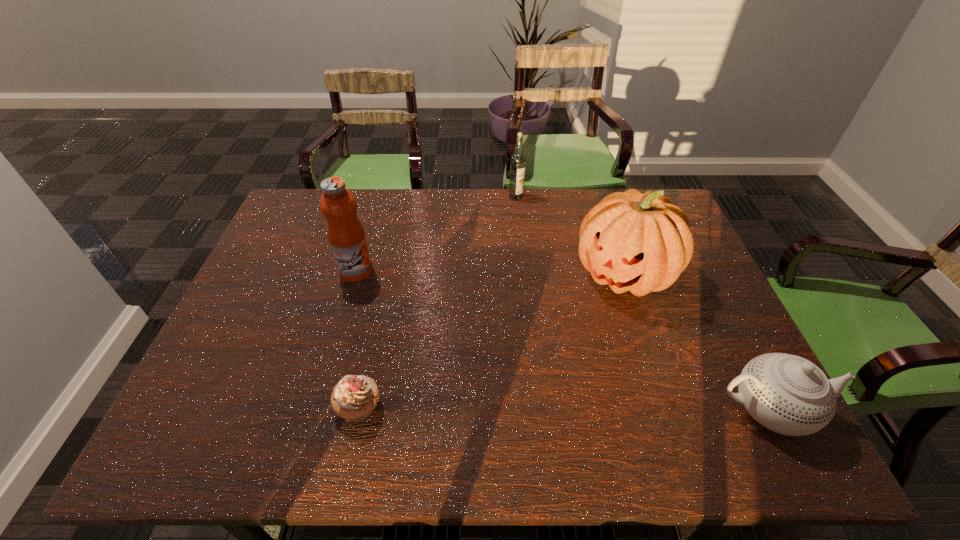
Find the location of a particular element. free spot on the desktop that is between the cupcake and the chinaware and is positioned on the front label of the fruit juice is located at coordinates (503, 408).

Identify the location of free spot on the desktop that is between the cupcake and the chinaware and is positioned on the label of the vodka. (584, 408).

At what (x,y) coordinates should I click in order to perform the action: click on free spot on the desktop that is between the shortest object and the chinaware and is positioned on the carved face of the pumpkin. Please return your answer as a coordinate pair (x, y). The width and height of the screenshot is (960, 540). Looking at the image, I should click on (503, 408).